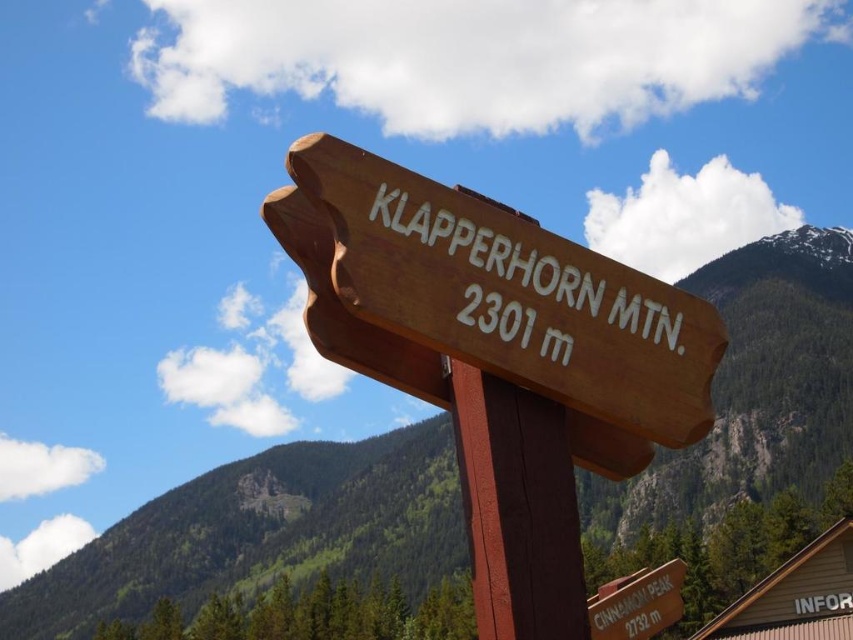
Question: Does wooden signpost at center appear on the left side of wooden sign at center?

Choices:
 (A) no
 (B) yes

Answer: (B)

Question: Which object appears farthest from the camera in this image?

Choices:
 (A) wooden signpost at center
 (B) wooden sign at center

Answer: (A)

Question: Among these points, which one is nearest to the camera?

Choices:
 (A) (614, 636)
 (B) (671, 488)
 (C) (561, 433)

Answer: (C)

Question: Is wooden signpost at center further to camera compared to wooden sign at center?

Choices:
 (A) no
 (B) yes

Answer: (B)

Question: Observing the image, what is the correct spatial positioning of wooden signpost at center in reference to brown wooden signpost at center?

Choices:
 (A) above
 (B) below

Answer: (B)

Question: Which object is the closest to the wooden sign at center?

Choices:
 (A) brown wooden signpost at center
 (B) wooden signpost at center
 (C) orange wood sign at lower right

Answer: (A)